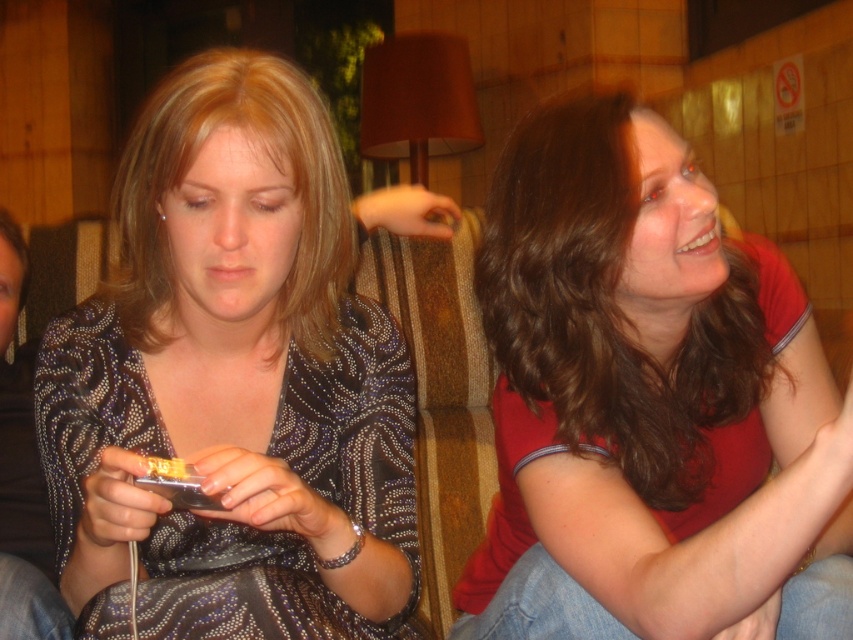
You are standing in a room with two objects in front of you, a matte black dress at center and a matte gold phone at lower left. Which object is closer to you?

The matte black dress at center is closer to you because it is further to the viewer than the matte gold phone at lower left.

Based on the photo, you are a fashion designer who wants to place a decorative pin on the sparkly dark blue dress at center. The coordinates given are point [233,381]. Is this point on the sparkly dark blue dress at center?

Yes, the point [233,381] is on the sparkly dark blue dress at center according to the description.

You are a photographer trying to capture a clear shot of the sparkly dark blue dress at center and the matte red shirt at right. Since both are in the same frame, which one is covering part of the other?

The sparkly dark blue dress at center is positioned over the matte red shirt at right, so it is covering part of the matte red shirt at right.